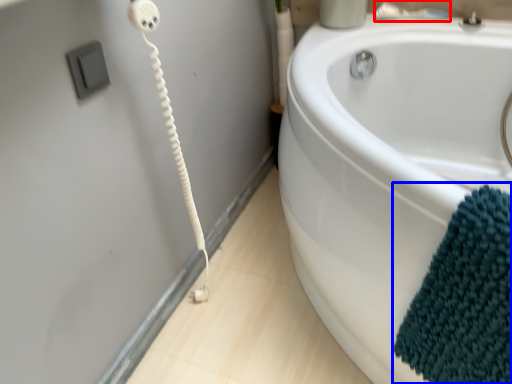
Question: Which point is closer to the camera, faucet (highlighted by a red box) or bath towel (highlighted by a blue box)?

Choices:
 (A) faucet
 (B) bath towel

Answer: (B)